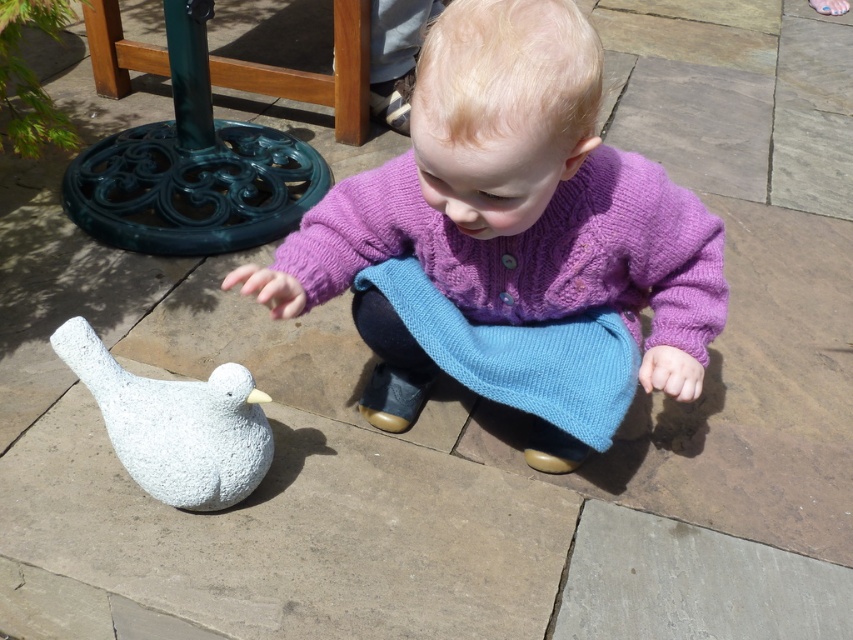
Between point (410, 227) and point (196, 400), which one is positioned behind?

The point (196, 400) is more distant.

Who is more forward, (x=543, y=237) or (x=239, y=385)?

Positioned in front is point (x=239, y=385).

You are a GUI agent. You are given a task and a screenshot of the screen. Output one action in this format:
    pyautogui.click(x=<x>, y=<y>)
    Task: Click on the purple knitted sweater at center
    The width and height of the screenshot is (853, 640).
    Given the screenshot: What is the action you would take?
    pyautogui.click(x=518, y=198)